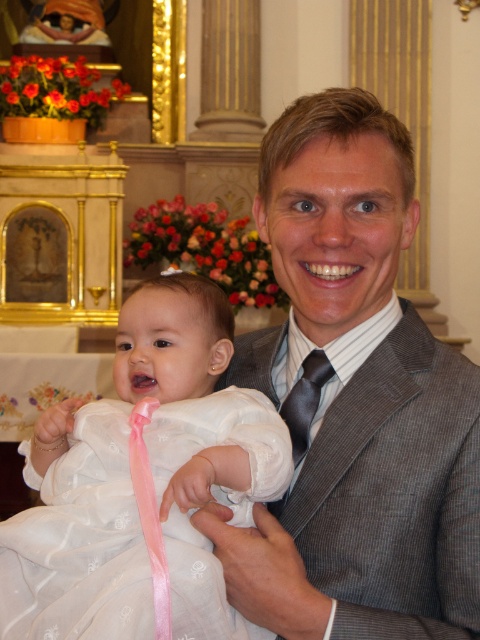
Who is taller, gray textured suit at center or white satin dress at center?

Standing taller between the two is gray textured suit at center.

Between point (394, 179) and point (92, 570), which one is positioned behind?

Positioned behind is point (394, 179).

Who is more distant from viewer, (398, 326) or (1, 612)?

The point (398, 326) is behind.

You are a GUI agent. You are given a task and a screenshot of the screen. Output one action in this format:
    pyautogui.click(x=<x>, y=<y>)
    Task: Click on the gray textured suit at center
    The width and height of the screenshot is (480, 640).
    Given the screenshot: What is the action you would take?
    pyautogui.click(x=360, y=403)

Based on the photo, who is more forward, (x=216, y=292) or (x=305, y=435)?

Positioned in front is point (x=216, y=292).

Who is taller, white satin dress at center or dark brown silk tie at center?

white satin dress at center is taller.

Which is in front, point (274, 454) or point (299, 458)?

Point (274, 454)

Find the location of a particular element. white satin dress at center is located at coordinates (153, 477).

Does gray textured suit at center appear on the left side of dark brown silk tie at center?

In fact, gray textured suit at center is to the right of dark brown silk tie at center.

In the scene shown: Who is more distant from viewer, (468,444) or (316,374)?

The point (316,374) is more distant.

The width and height of the screenshot is (480, 640). What do you see at coordinates (360, 403) in the screenshot? I see `gray textured suit at center` at bounding box center [360, 403].

Identify the location of gray textured suit at center. The width and height of the screenshot is (480, 640). (360, 403).